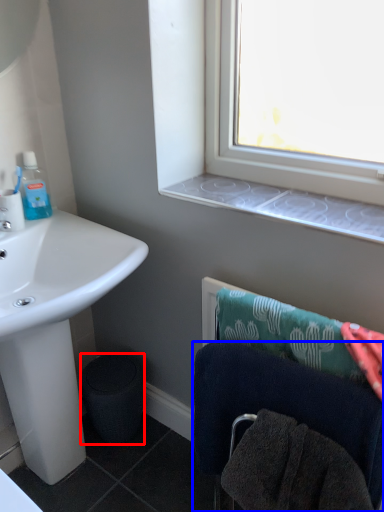
Question: Which object appears closest to the camera in this image, trash bin/can (highlighted by a red box) or towel (highlighted by a blue box)?

Choices:
 (A) trash bin/can
 (B) towel

Answer: (B)